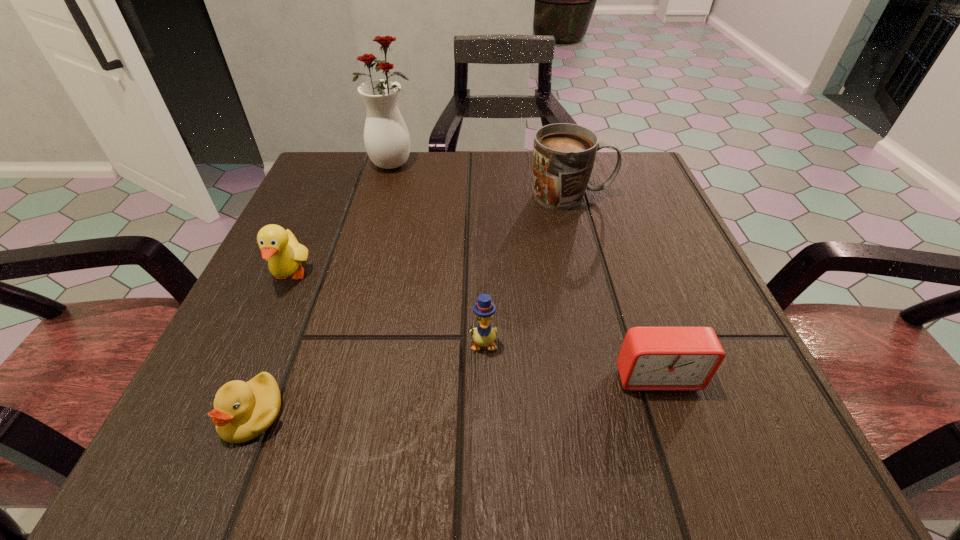
Find the location of a particular element. alarm clock present at the right edge is located at coordinates (651, 358).

Where is `object positioned at the far left corner`? This screenshot has height=540, width=960. object positioned at the far left corner is located at coordinates (386, 137).

The image size is (960, 540). I want to click on object that is at the near left corner, so click(x=242, y=411).

You are a GUI agent. You are given a task and a screenshot of the screen. Output one action in this format:
    pyautogui.click(x=<x>, y=<y>)
    Task: Click on the object that is positioned at the far right corner
    Image resolution: width=960 pixels, height=540 pixels.
    Given the screenshot: What is the action you would take?
    pyautogui.click(x=564, y=154)

In the image, there is a desktop. At what (x,y) coordinates should I click in order to perform the action: click on free space at the far edge. Please return your answer as a coordinate pair (x, y). The image size is (960, 540). Looking at the image, I should click on (476, 184).

Locate an element on the screen. The height and width of the screenshot is (540, 960). free space at the left edge of the desktop is located at coordinates (258, 314).

The height and width of the screenshot is (540, 960). In order to click on vacant space at the right edge of the desktop in this screenshot , I will do `click(638, 227)`.

Where is `free location at the far left corner`? This screenshot has width=960, height=540. free location at the far left corner is located at coordinates (370, 194).

Where is `blank space at the far right corner`? The height and width of the screenshot is (540, 960). blank space at the far right corner is located at coordinates (657, 206).

The width and height of the screenshot is (960, 540). I want to click on vacant space at the near right corner of the desktop, so click(691, 465).